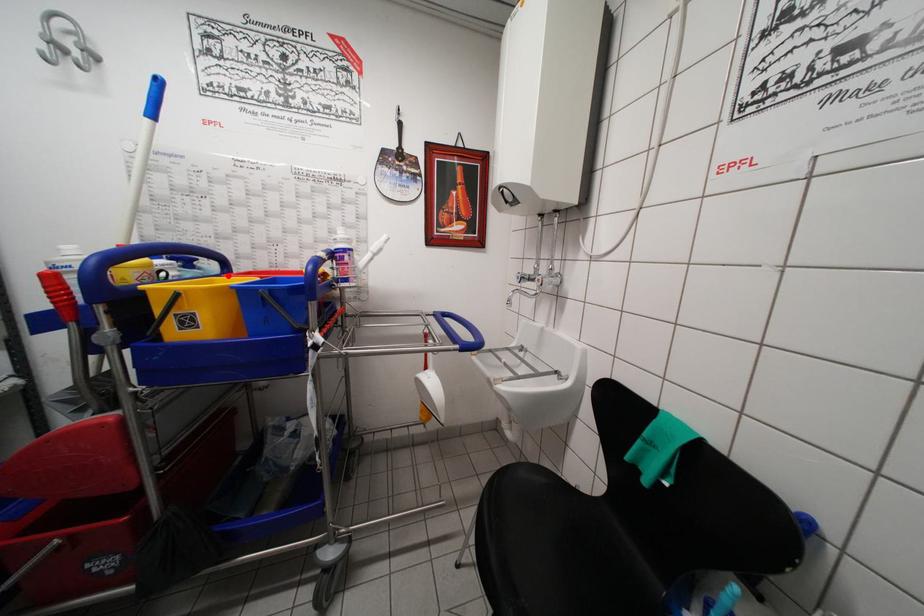
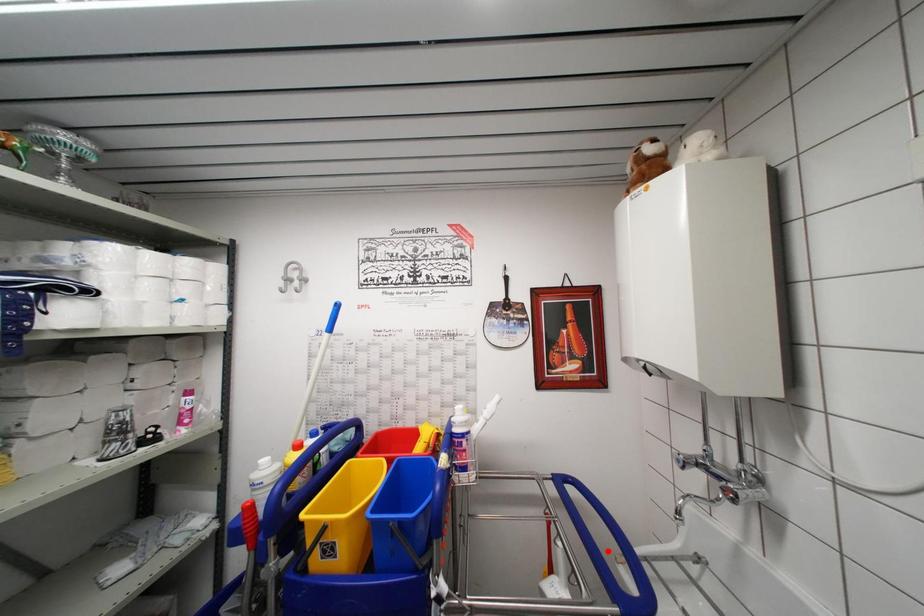
I am providing you with two images of the same scene from different viewpoints. A red point is marked on the first image and another point is marked on the second image. Is the red point in image1 aligned with the point shown in image2?

No